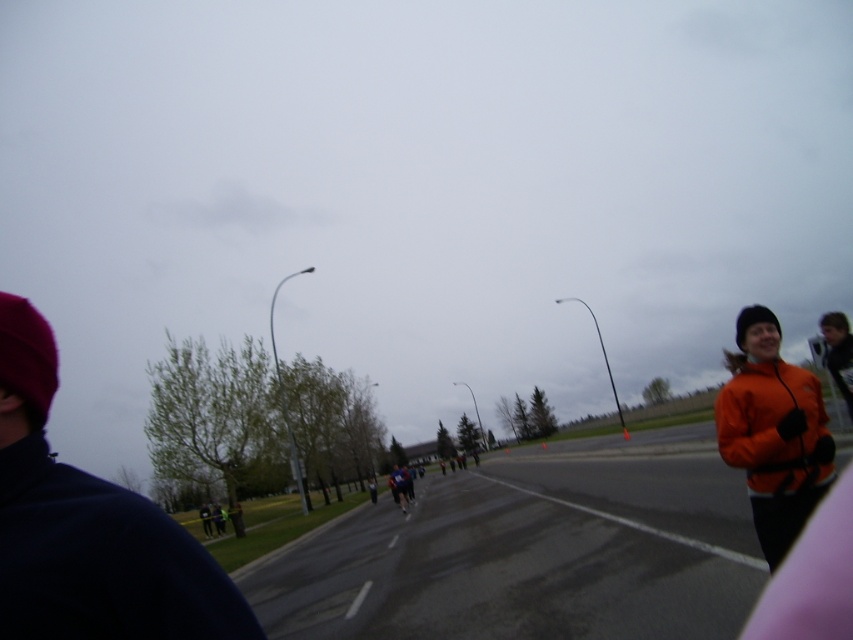
Question: Is orange fleece jacket at right closer to the viewer compared to orange jacket at right?

Choices:
 (A) yes
 (B) no

Answer: (A)

Question: Does dark blue jacket at left appear on the right side of orange jacket at right?

Choices:
 (A) no
 (B) yes

Answer: (A)

Question: Which point is farther from the camera taking this photo?

Choices:
 (A) (730, 449)
 (B) (24, 456)

Answer: (A)

Question: Can you confirm if dark blue jacket at left is positioned to the right of orange fleece jacket at right?

Choices:
 (A) yes
 (B) no

Answer: (B)

Question: Which point appears closest to the camera in this image?

Choices:
 (A) (785, 408)
 (B) (849, 412)

Answer: (A)

Question: Which point is farther from the camera taking this photo?

Choices:
 (A) (717, 448)
 (B) (833, 330)
 (C) (16, 518)

Answer: (A)